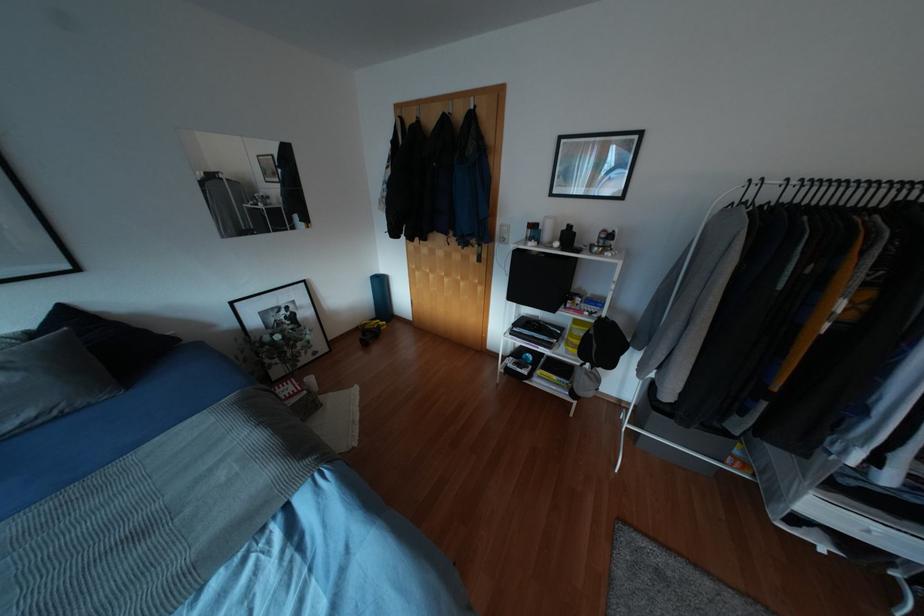
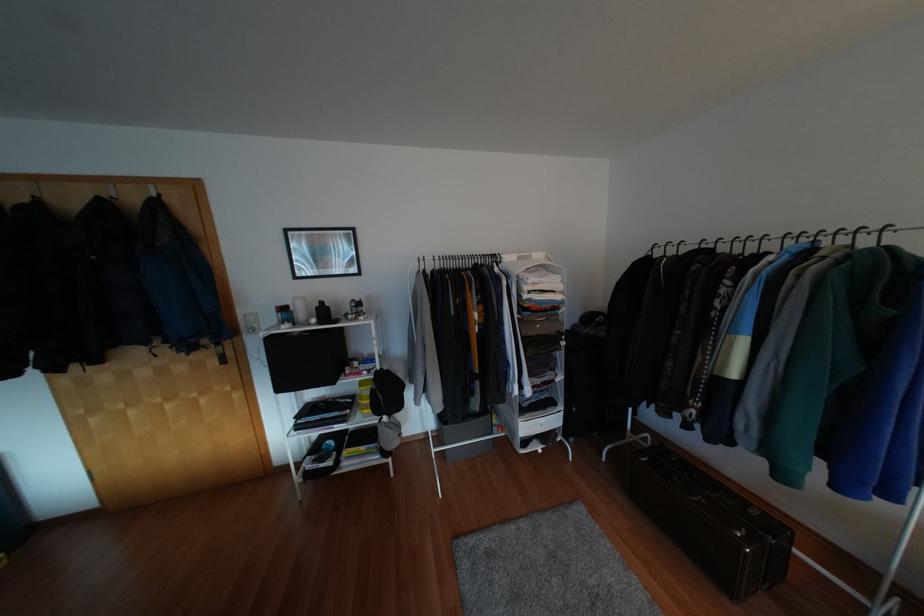
Question: Based on the continuous images, in which direction is the camera rotating? Reply with the corresponding letter.

Choices:
 (A) Left
 (B) Right
 (C) Up
 (D) Down

Answer: (B)